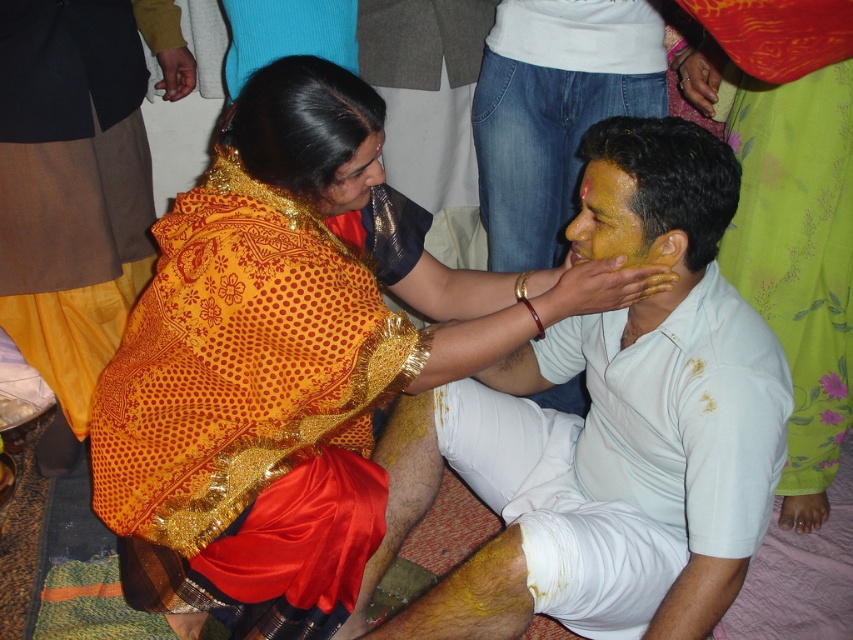
Does white cotton shirt at center have a greater height compared to matte gold saree at center?

Indeed, white cotton shirt at center has a greater height compared to matte gold saree at center.

Is white cotton shirt at center further to the viewer compared to matte gold saree at center?

No, it is not.

The height and width of the screenshot is (640, 853). What are the coordinates of `white cotton shirt at center` in the screenshot? It's located at (x=610, y=436).

Looking at this image, can you confirm if golden brocade saree at center is thinner than matte gold saree at center?

Incorrect, golden brocade saree at center's width is not less than matte gold saree at center's.

Is golden brocade saree at center shorter than matte gold saree at center?

In fact, golden brocade saree at center may be taller than matte gold saree at center.

This screenshot has height=640, width=853. What are the coordinates of `golden brocade saree at center` in the screenshot? It's located at (285, 369).

Is golden brocade saree at center bigger than yellow matte face at center?

Yes.

Is point (207, 448) positioned in front of point (627, 216)?

No, (207, 448) is behind (627, 216).

Where is `golden brocade saree at center`? The height and width of the screenshot is (640, 853). golden brocade saree at center is located at coordinates pos(285,369).